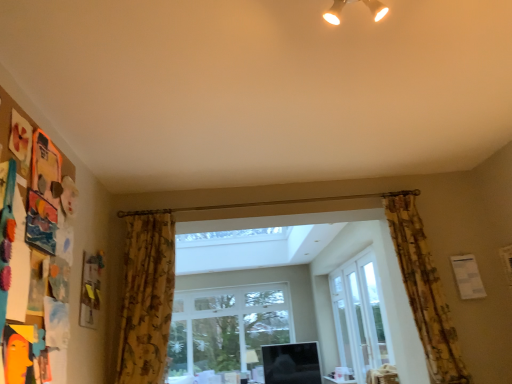
Question: Is there a large distance between white glass screen door at center and floral fabric curtain at right, marked as the 1th curtain in a right-to-left arrangement?

Choices:
 (A) yes
 (B) no

Answer: (A)

Question: Can you confirm if white glass screen door at center is positioned to the right of floral fabric curtain at right, marked as the 1th curtain in a right-to-left arrangement?

Choices:
 (A) no
 (B) yes

Answer: (B)

Question: Does white glass screen door at center have a lesser width compared to floral fabric curtain at right, the 2th curtain from the left?

Choices:
 (A) yes
 (B) no

Answer: (A)

Question: Are white glass screen door at center and floral fabric curtain at right, marked as the 1th curtain in a right-to-left arrangement, making contact?

Choices:
 (A) yes
 (B) no

Answer: (B)

Question: From the image's perspective, is white glass screen door at center located beneath floral fabric curtain at right, marked as the 1th curtain in a right-to-left arrangement?

Choices:
 (A) yes
 (B) no

Answer: (A)

Question: Could you tell me if white glass screen door at center is facing floral fabric curtain at right, marked as the 1th curtain in a right-to-left arrangement?

Choices:
 (A) yes
 (B) no

Answer: (B)

Question: Can you confirm if clear glass window at center, the first window from the left, is taller than floral fabric curtain at right, marked as the 1th curtain in a right-to-left arrangement?

Choices:
 (A) no
 (B) yes

Answer: (B)

Question: From a real-world perspective, is clear glass window at center, arranged as the 2th window when viewed from the right, below floral fabric curtain at right, the 2th curtain from the left?

Choices:
 (A) yes
 (B) no

Answer: (A)

Question: From a real-world perspective, is clear glass window at center, the second window in the front-to-back sequence, on floral fabric curtain at right, the 2th curtain from the left?

Choices:
 (A) yes
 (B) no

Answer: (B)

Question: From the image's perspective, is clear glass window at center, arranged as the 2th window when viewed from the right, beneath floral fabric curtain at right, the 2th curtain from the left?

Choices:
 (A) yes
 (B) no

Answer: (A)

Question: Is clear glass window at center, arranged as the 2th window when viewed from the right, at the left side of floral fabric curtain at right, the 2th curtain from the left?

Choices:
 (A) no
 (B) yes

Answer: (B)

Question: Would you say floral fabric curtain at right, marked as the 1th curtain in a right-to-left arrangement, is part of clear glass window at center, the second window in the front-to-back sequence,'s contents?

Choices:
 (A) no
 (B) yes

Answer: (A)

Question: Is white glass door at center, the first window viewed from the right, with floral fabric curtain at right, marked as the 1th curtain in a right-to-left arrangement?

Choices:
 (A) no
 (B) yes

Answer: (A)